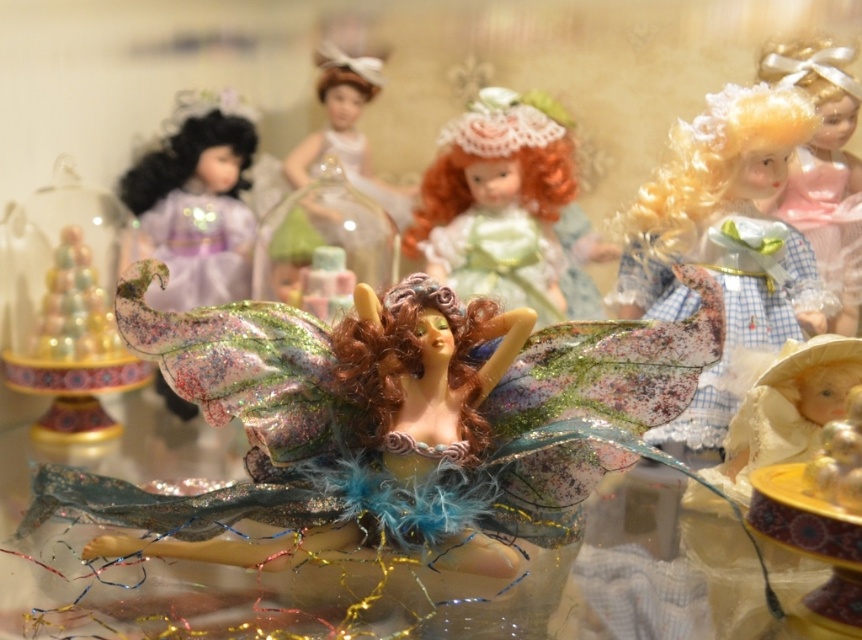
Question: Considering the real-world distances, which object is closest to the checkered fabric dress at right?

Choices:
 (A) pastel green fabric doll at center
 (B) pastel plaid dress at right

Answer: (B)

Question: Does pastel plaid dress at right have a larger size compared to translucent glass jar at center?

Choices:
 (A) no
 (B) yes

Answer: (B)

Question: Considering the relative positions of pastel plaid dress at right and translucent glass jar at center in the image provided, where is pastel plaid dress at right located with respect to translucent glass jar at center?

Choices:
 (A) left
 (B) right

Answer: (B)

Question: Estimate the real-world distances between objects in this image. Which object is farther from the pastel glitter fairy at center?

Choices:
 (A) checkered fabric dress at right
 (B) matte purple dress at left

Answer: (A)

Question: Which point is farther from the camera taking this photo?

Choices:
 (A) (703, 388)
 (B) (330, 86)
 (C) (345, 273)
 (D) (485, 88)

Answer: (B)

Question: Is checkered fabric dress at right below matte purple dress at left?

Choices:
 (A) no
 (B) yes

Answer: (B)